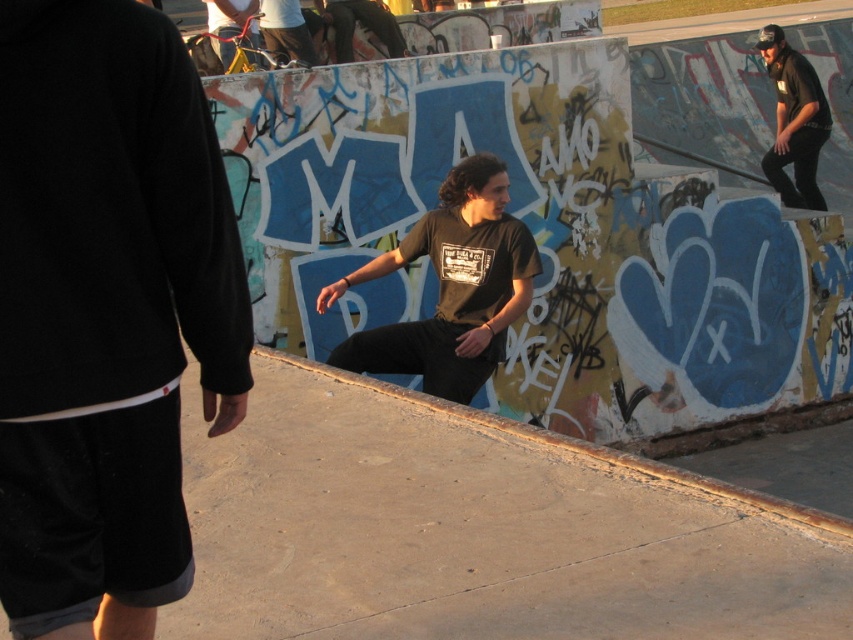
Which is behind, point (57, 312) or point (395, 337)?

The point (395, 337) is behind.

Image resolution: width=853 pixels, height=640 pixels. I want to click on black matte shorts at lower left, so click(x=106, y=312).

What do you see at coordinates (106, 312) in the screenshot? The image size is (853, 640). I see `black matte shorts at lower left` at bounding box center [106, 312].

Where is `black matte shorts at lower left`? The image size is (853, 640). black matte shorts at lower left is located at coordinates [x=106, y=312].

What do you see at coordinates (106, 312) in the screenshot?
I see `black matte shorts at lower left` at bounding box center [106, 312].

Who is taller, black matte shorts at lower left or black matte pants at upper right?

With more height is black matte pants at upper right.

Does point (163, 243) come closer to viewer compared to point (793, 115)?

Yes, point (163, 243) is in front of point (793, 115).

I want to click on black matte shorts at lower left, so click(x=106, y=312).

Measure the distance between black matte t-shirt at center and camera.

The distance of black matte t-shirt at center from camera is 6.57 meters.

The width and height of the screenshot is (853, 640). Find the location of `black matte t-shirt at center`. black matte t-shirt at center is located at coordinates (450, 288).